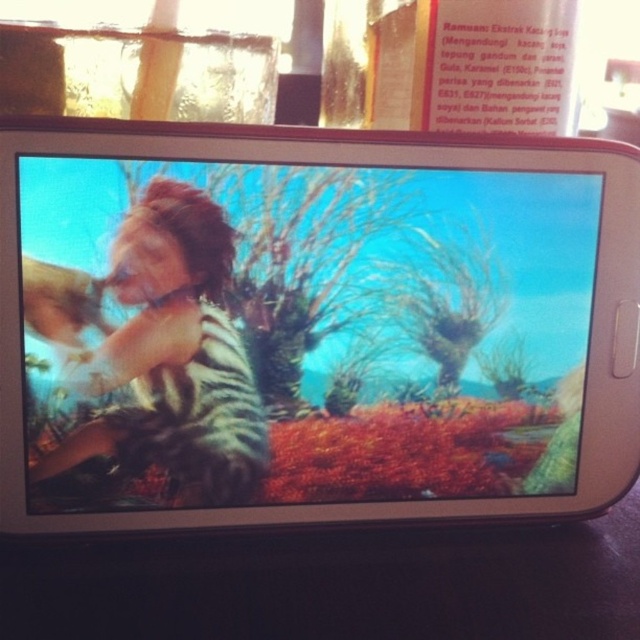
Can you confirm if matte plastic screen at center is wider than shiny metallic phone at center?

Yes.

From the picture: Between matte plastic screen at center and shiny metallic phone at center, which one appears on the left side from the viewer's perspective?

shiny metallic phone at center

Where is `matte plastic screen at center`? Image resolution: width=640 pixels, height=640 pixels. matte plastic screen at center is located at coordinates (301, 328).